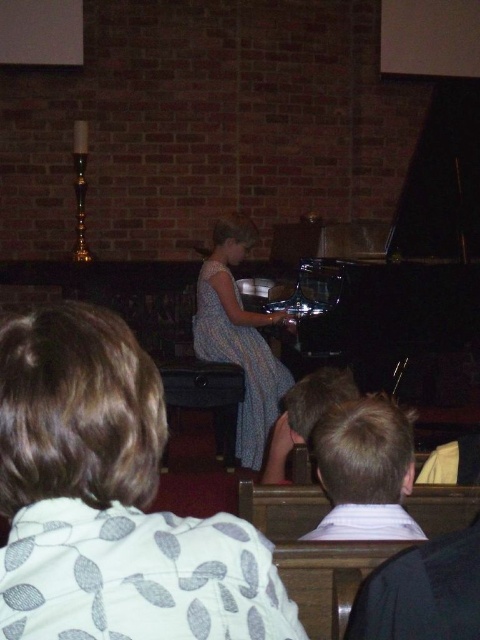
Question: Can you confirm if black polished piano at center is bigger than blue dotted fabric dress at center?

Choices:
 (A) yes
 (B) no

Answer: (A)

Question: Can you confirm if matte gray dress at center is positioned to the left of blue dotted fabric dress at center?

Choices:
 (A) no
 (B) yes

Answer: (B)

Question: Which of the following is the farthest from the observer?

Choices:
 (A) matte gray dress at center
 (B) black polished piano at center

Answer: (B)

Question: Among these objects, which one is farthest from the camera?

Choices:
 (A) blue dotted fabric dress at center
 (B) black polished piano at center
 (C) matte gray dress at center

Answer: (A)

Question: Does matte gray dress at center appear on the left side of black polished piano at center?

Choices:
 (A) yes
 (B) no

Answer: (A)

Question: Which of these objects is positioned farthest from the blue dotted fabric dress at center?

Choices:
 (A) matte gray dress at center
 (B) black polished piano at center

Answer: (A)